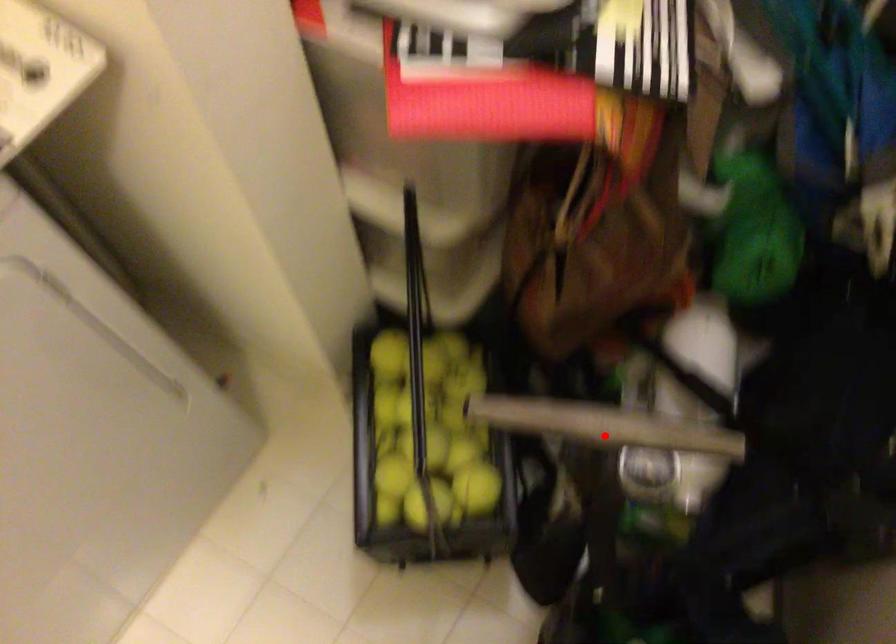
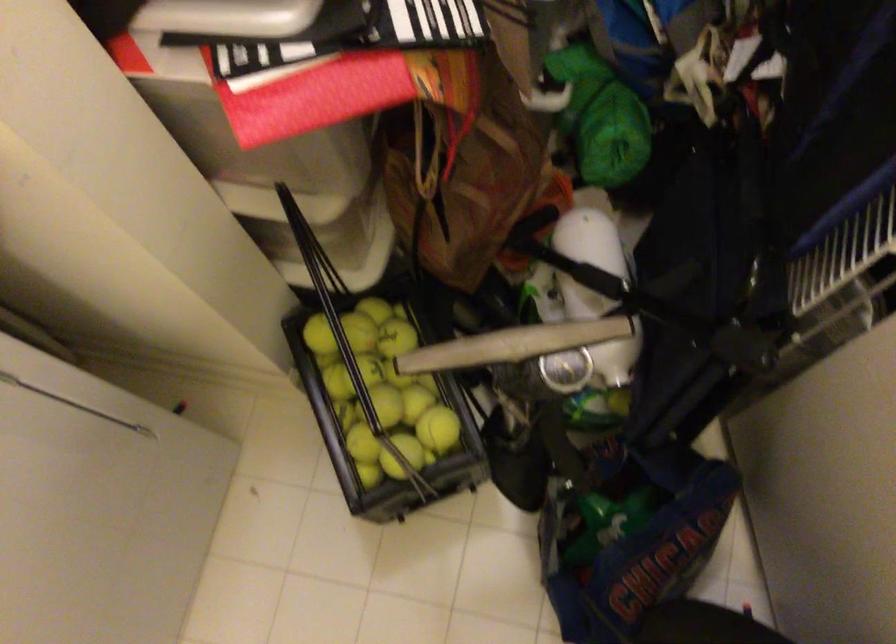
Find the pixel in the second image that matches the highlighted location in the first image.

(513, 345)